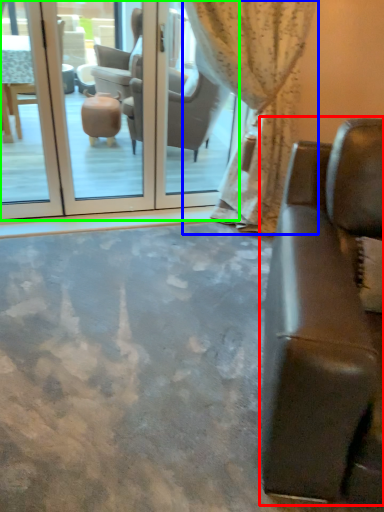
Question: Which object is the farthest from studio couch (highlighted by a red box)? Choose among these: curtain (highlighted by a blue box) or screen door (highlighted by a green box).

Choices:
 (A) curtain
 (B) screen door

Answer: (B)